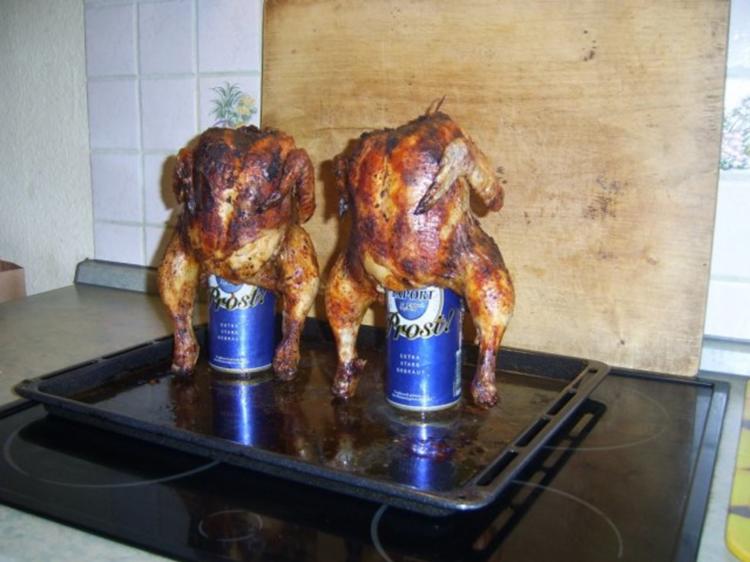
Locate an element on the screen. The width and height of the screenshot is (750, 562). sheet is located at coordinates (208, 448).